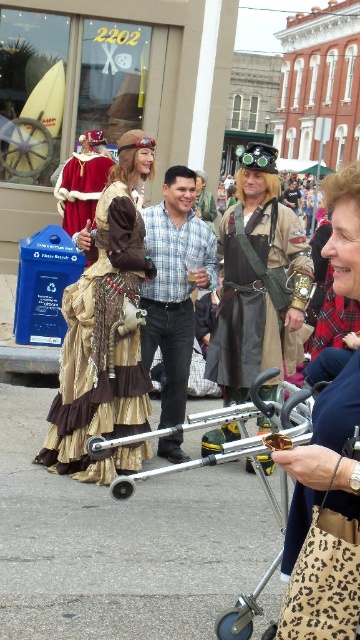
Question: Estimate the real-world distances between objects in this image. Which object is farther from the metallic silver baby carriage at center?

Choices:
 (A) leopard print purse at center
 (B) steampunk attire at center
 (C) gold fabric dress at center

Answer: (C)

Question: Can you confirm if leopard print purse at center is bigger than metallic silver baby carriage at center?

Choices:
 (A) no
 (B) yes

Answer: (A)

Question: Which point is farther to the camera?

Choices:
 (A) [129, 156]
 (B) [164, 189]

Answer: (B)

Question: Is leopard print purse at center thinner than plaid shirt at center?

Choices:
 (A) yes
 (B) no

Answer: (B)

Question: Which object is the farthest from the steampunk attire at center?

Choices:
 (A) plaid shirt at center
 (B) metallic silver baby carriage at center

Answer: (B)

Question: Does gold fabric dress at center have a larger size compared to plaid shirt at center?

Choices:
 (A) yes
 (B) no

Answer: (A)